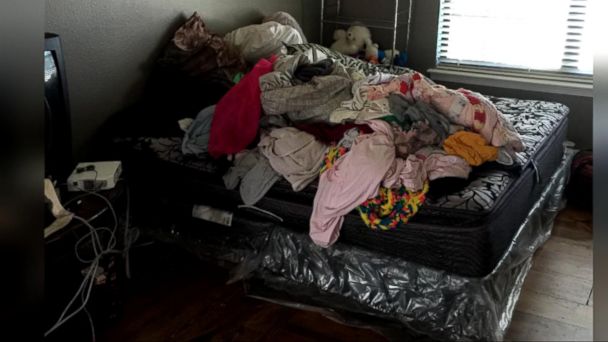
Find the location of `crotched blanket`. crotched blanket is located at coordinates (x=381, y=220).